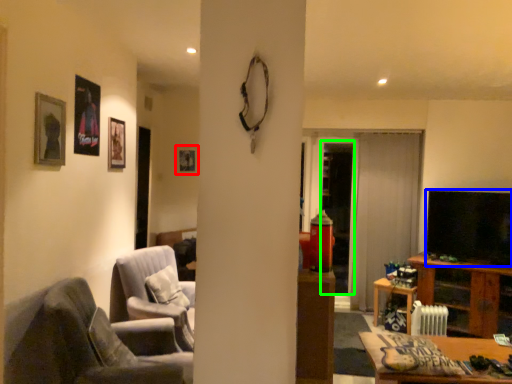
Question: Which is nearer to the picture frame (highlighted by a red box)? television (highlighted by a blue box) or glass door (highlighted by a green box).

Choices:
 (A) television
 (B) glass door

Answer: (B)